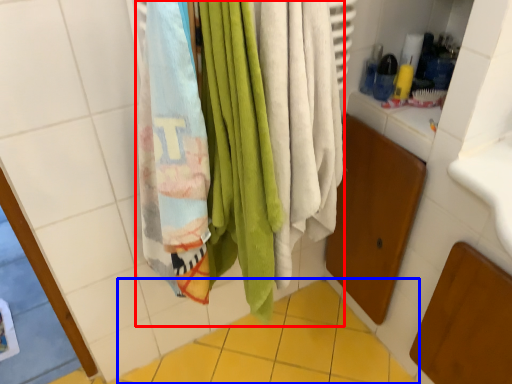
Question: Among these objects, which one is nearest to the camera, beach towel (highlighted by a red box) or ceramic tile (highlighted by a blue box)?

Choices:
 (A) beach towel
 (B) ceramic tile

Answer: (A)